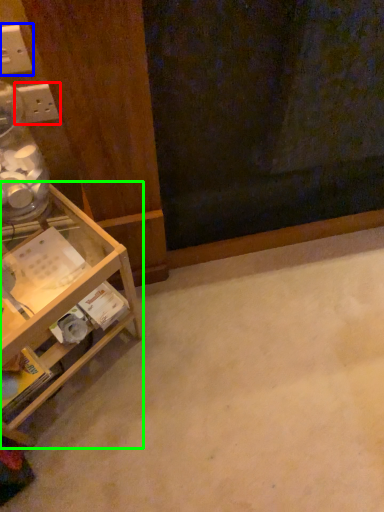
Question: Considering the real-world distances, which object is farthest from electric outlet (highlighted by a red box)? electric outlet (highlighted by a blue box) or shelf (highlighted by a green box)?

Choices:
 (A) electric outlet
 (B) shelf

Answer: (B)